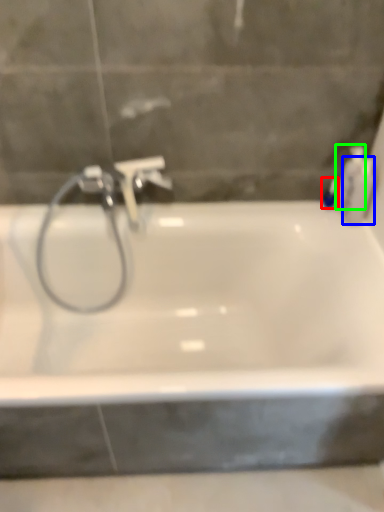
Question: Estimate the real-world distances between objects in this image. Which object is closer to toiletry (highlighted by a red box), toiletry (highlighted by a blue box) or toiletry (highlighted by a green box)?

Choices:
 (A) toiletry
 (B) toiletry

Answer: (B)